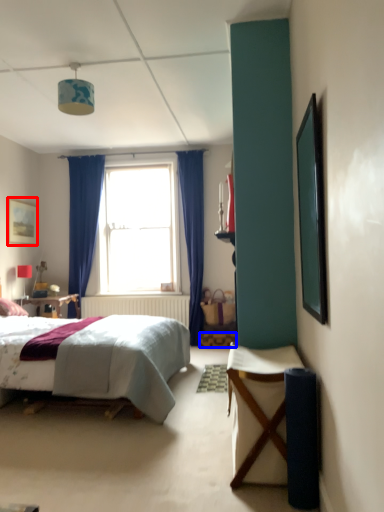
Question: Which object is closer to the camera taking this photo, picture frame (highlighted by a red box) or stool (highlighted by a blue box)?

Choices:
 (A) picture frame
 (B) stool

Answer: (A)